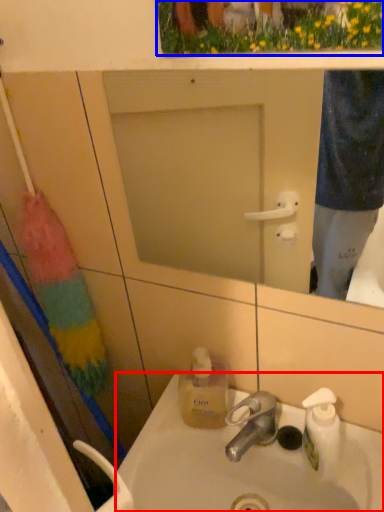
Question: Which of the following is the closest to the observer, sink (highlighted by a red box) or flower (highlighted by a blue box)?

Choices:
 (A) sink
 (B) flower

Answer: (B)